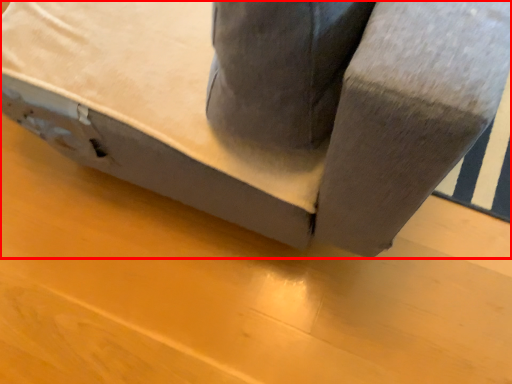
Question: From the image's perspective, what is the correct spatial relationship of furniture (annotated by the red box) in relation to plywood?

Choices:
 (A) below
 (B) above

Answer: (B)